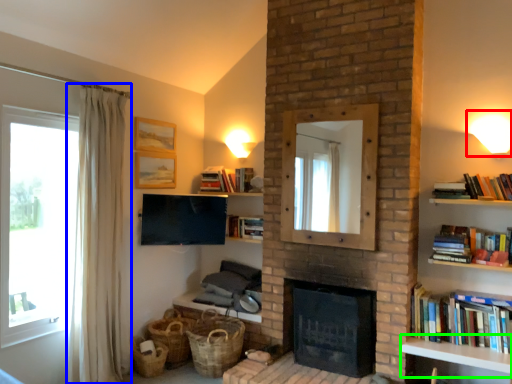
Question: Which object is the closest to the light fixture (highlighted by a red box)? Choose among these: curtain (highlighted by a blue box) or table (highlighted by a green box).

Choices:
 (A) curtain
 (B) table

Answer: (B)